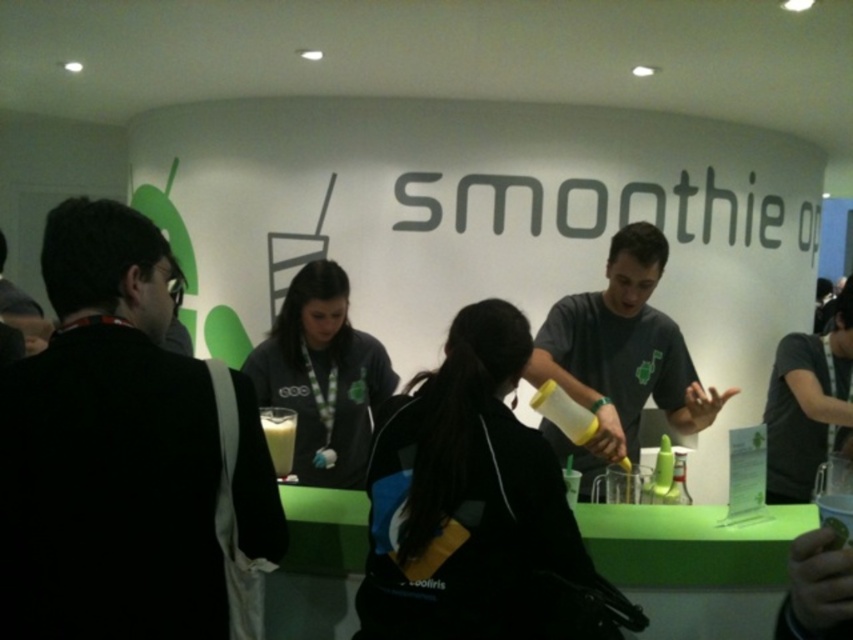
Question: Which of the following is the closest to the observer?

Choices:
 (A) (283, 445)
 (B) (838, 330)

Answer: (A)

Question: Which of the following is the farthest from the observer?

Choices:
 (A) (849, 516)
 (B) (648, 396)
 (C) (136, 310)
 (D) (784, 349)

Answer: (D)

Question: Which point is farther to the camera?

Choices:
 (A) (822, 433)
 (B) (598, 308)
 (C) (271, 422)

Answer: (A)

Question: Observing the image, what is the correct spatial positioning of dark gray t-shirt at right in reference to white opaque smoothie at center?

Choices:
 (A) left
 (B) right

Answer: (B)

Question: Is matte gray shirt at center above dark gray t-shirt at right?

Choices:
 (A) no
 (B) yes

Answer: (B)

Question: Can you confirm if matte gray shirt at center is positioned to the left of dark gray t-shirt at right?

Choices:
 (A) no
 (B) yes

Answer: (B)